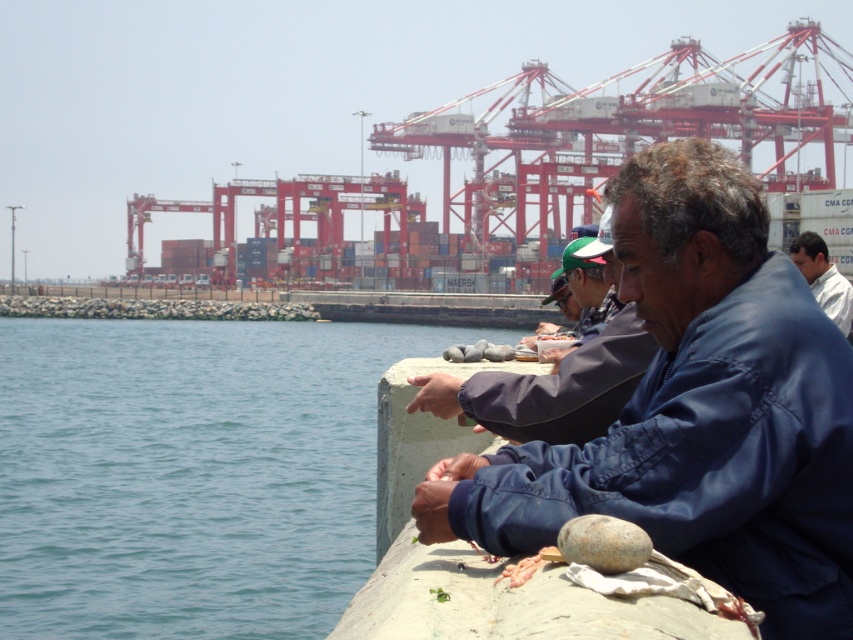
Looking at this image, you are observing two people at the port scene described. The first person is wearing a blue fabric jacket at center, and the second is wearing a white cotton shirt at right. Based on the scene description, which person is closer to the camera?

The blue fabric jacket at center is shorter than the white cotton shirt at right, so the person wearing the blue fabric jacket at center is closer to the camera.